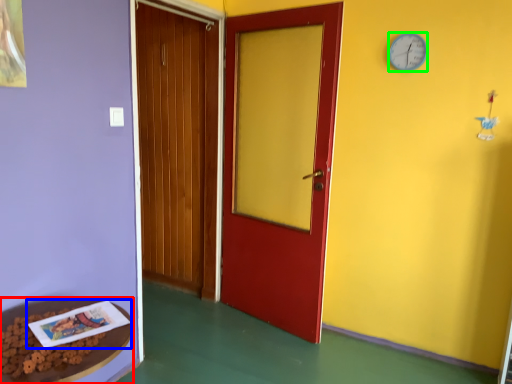
Question: Considering the real-world distances, which object is farthest from table (highlighted by a red box)? book (highlighted by a blue box) or clock (highlighted by a green box)?

Choices:
 (A) book
 (B) clock

Answer: (B)